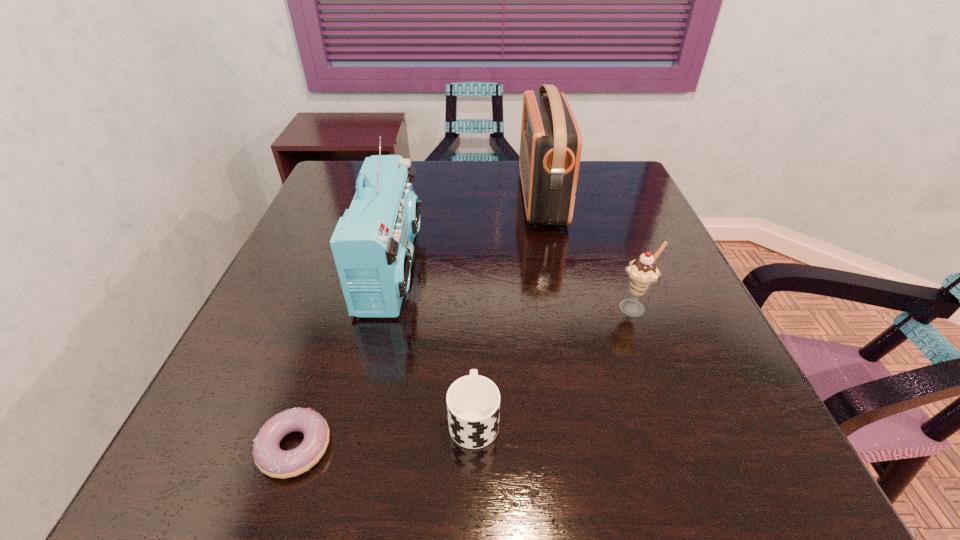
Locate an element on the screen. The height and width of the screenshot is (540, 960). free space located 0.290m on the front-facing side of the left radio receiver is located at coordinates (543, 268).

This screenshot has height=540, width=960. I want to click on free location located 0.210m on the left of the third tallest object, so click(514, 308).

Locate an element on the screen. blank space located on the side of the cup with the handle is located at coordinates (474, 362).

Find the location of `vacant space located on the side of the cup with the handle`. vacant space located on the side of the cup with the handle is located at coordinates (476, 263).

This screenshot has width=960, height=540. I want to click on vacant area located 0.170m on the side of the cup with the handle, so click(x=475, y=319).

Locate an element on the screen. free space located on the back of the doughnut is located at coordinates (322, 367).

Find the location of a particular element. Image resolution: width=960 pixels, height=540 pixels. object that is at the far edge is located at coordinates (551, 143).

At what (x,y) coordinates should I click in order to perform the action: click on cup at the near edge. Please return your answer as a coordinate pair (x, y). The height and width of the screenshot is (540, 960). Looking at the image, I should click on (473, 402).

Where is `doughnut present at the near edge`? The width and height of the screenshot is (960, 540). doughnut present at the near edge is located at coordinates (271, 460).

Locate an element on the screen. object that is at the left edge is located at coordinates (271, 460).